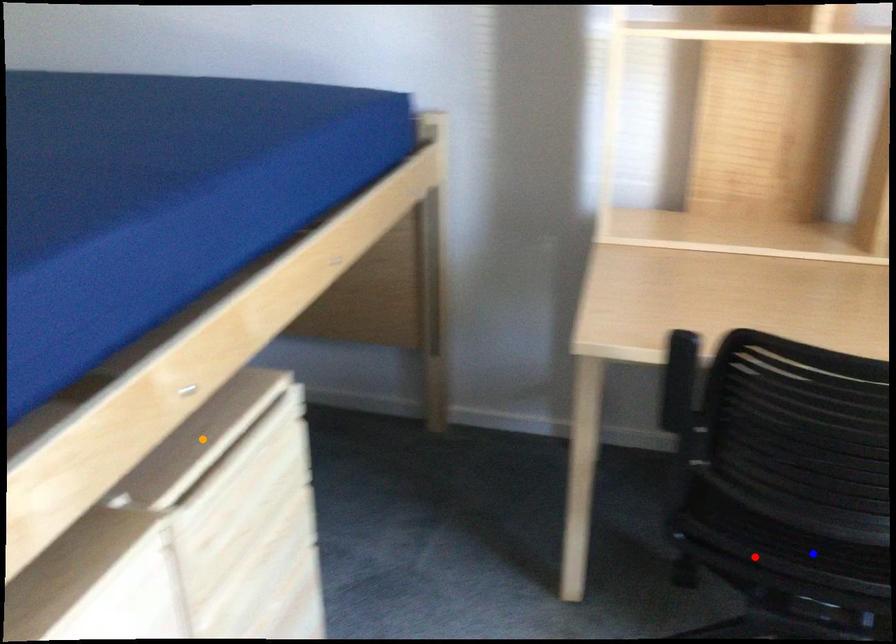
Order these from nearest to farthest:
- blue point
- orange point
- red point

orange point
blue point
red point